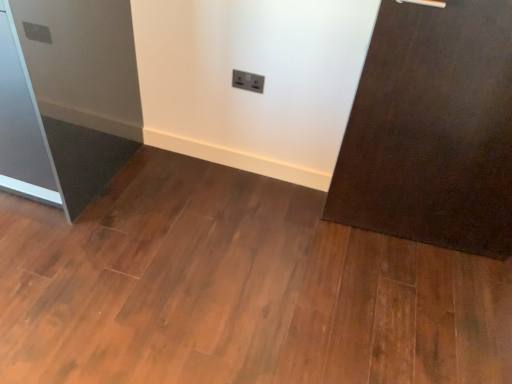
Image resolution: width=512 pixels, height=384 pixels. I want to click on free location in front of satin silver fridge at left, so click(x=56, y=268).